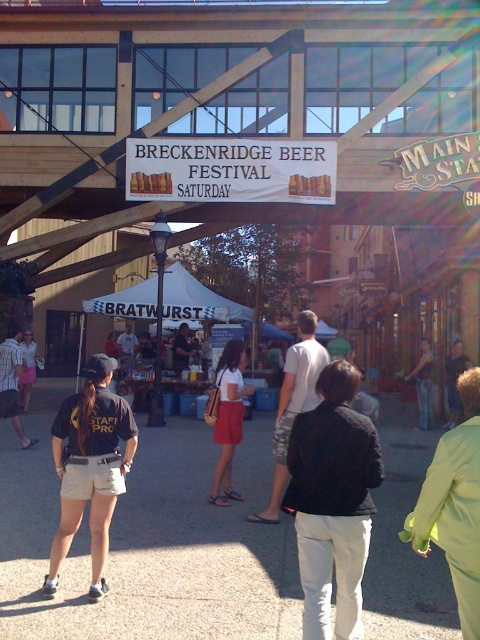
You are a photographer at the Breckenridge Beer Festival. You need to capture a photo of the black matte jacket at lower center and denim pants at center. Which object should you zoom in on to ensure both are in focus?

The black matte jacket at lower center is smaller than denim pants at center, so you should zoom in on the black matte jacket at lower center to ensure both are in focus.

You are a photographer at the Breckenridge Beer Festival. You need to capture a photo that includes both the black matte jacket at lower center and the matte white shirt at center. Which of the two clothing items appears smaller in the photo?

The black matte jacket at lower center appears smaller in the photo compared to the matte white shirt at center because it has a smaller size according to the description.

You are a photographer at the Breckenridge Beer Festival and want to capture a photo of the bright green coat at lower right and camouflage shorts at center. Since you want both subjects to appear equally prominent in the photo, which subject should you move closer to?

The bright green coat at lower right has a smaller size compared to camouflage shorts at center. To make both subjects appear equally prominent in the photo, you should move closer to the bright green coat at lower right to compensate for its smaller size.